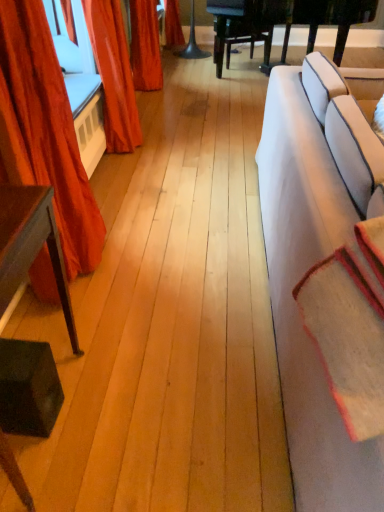
Find the location of a particular element. Image resolution: width=384 pixels, height=512 pixels. vacant space to the right of velvet orange curtain at upper left, which appears as the first curtain when viewed from the back is located at coordinates (177, 143).